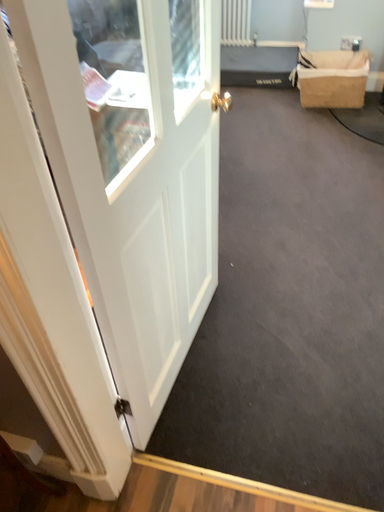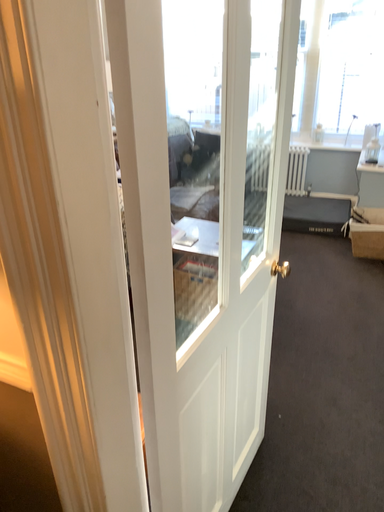
Question: Which way did the camera rotate in the video?

Choices:
 (A) rotated upward
 (B) rotated downward

Answer: (A)